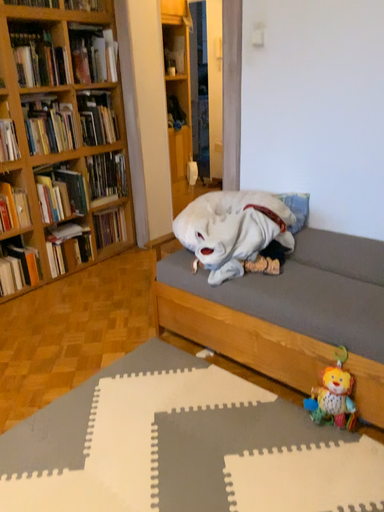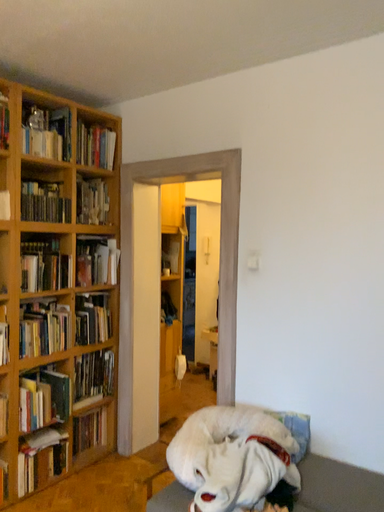
Question: How did the camera likely rotate when shooting the video?

Choices:
 (A) rotated upward
 (B) rotated downward

Answer: (A)